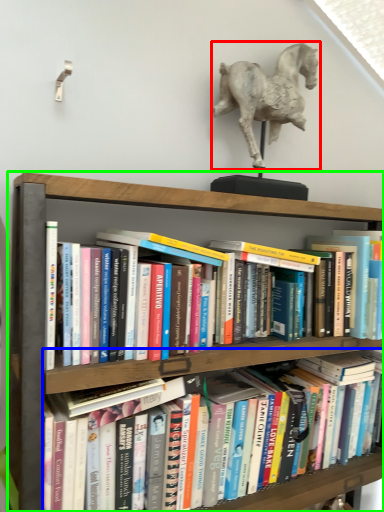
Question: Which is nearer to the horse (highlighted by a red box)? book (highlighted by a blue box) or shelf (highlighted by a green box).

Choices:
 (A) book
 (B) shelf

Answer: (B)